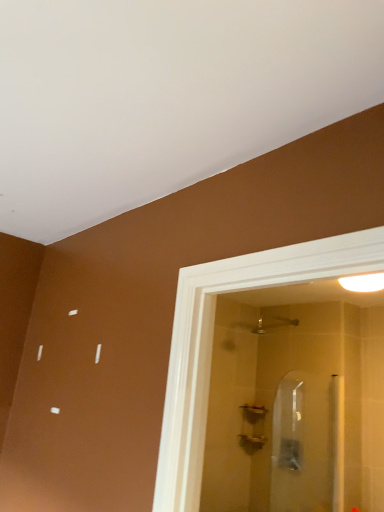
Question: Is white glossy light fixture at upper right in contact with clear glass screen door at center?

Choices:
 (A) no
 (B) yes

Answer: (A)

Question: Is white glossy light fixture at upper right further to the viewer compared to clear glass screen door at center?

Choices:
 (A) no
 (B) yes

Answer: (A)

Question: Considering the relative positions of white glossy light fixture at upper right and clear glass screen door at center in the image provided, is white glossy light fixture at upper right in front of clear glass screen door at center?

Choices:
 (A) no
 (B) yes

Answer: (B)

Question: Are white glossy light fixture at upper right and clear glass screen door at center located far from each other?

Choices:
 (A) no
 (B) yes

Answer: (B)

Question: From a real-world perspective, is white glossy light fixture at upper right under clear glass screen door at center?

Choices:
 (A) no
 (B) yes

Answer: (A)

Question: Could you tell me if white glossy light fixture at upper right is facing clear glass screen door at center?

Choices:
 (A) yes
 (B) no

Answer: (B)

Question: Is clear glass screen door at center located outside white glossy light fixture at upper right?

Choices:
 (A) yes
 (B) no

Answer: (A)

Question: Is clear glass screen door at center in front of white glossy light fixture at upper right?

Choices:
 (A) no
 (B) yes

Answer: (A)

Question: From a real-world perspective, is clear glass screen door at center over white glossy light fixture at upper right?

Choices:
 (A) yes
 (B) no

Answer: (B)

Question: From a real-world perspective, is clear glass screen door at center under white glossy light fixture at upper right?

Choices:
 (A) yes
 (B) no

Answer: (A)

Question: Is clear glass screen door at center further to the viewer compared to white glossy light fixture at upper right?

Choices:
 (A) yes
 (B) no

Answer: (A)

Question: Does clear glass screen door at center appear on the right side of white glossy light fixture at upper right?

Choices:
 (A) no
 (B) yes

Answer: (A)

Question: Would you say matte silver showerhead at upper center is outside white glossy light fixture at upper right?

Choices:
 (A) no
 (B) yes

Answer: (B)